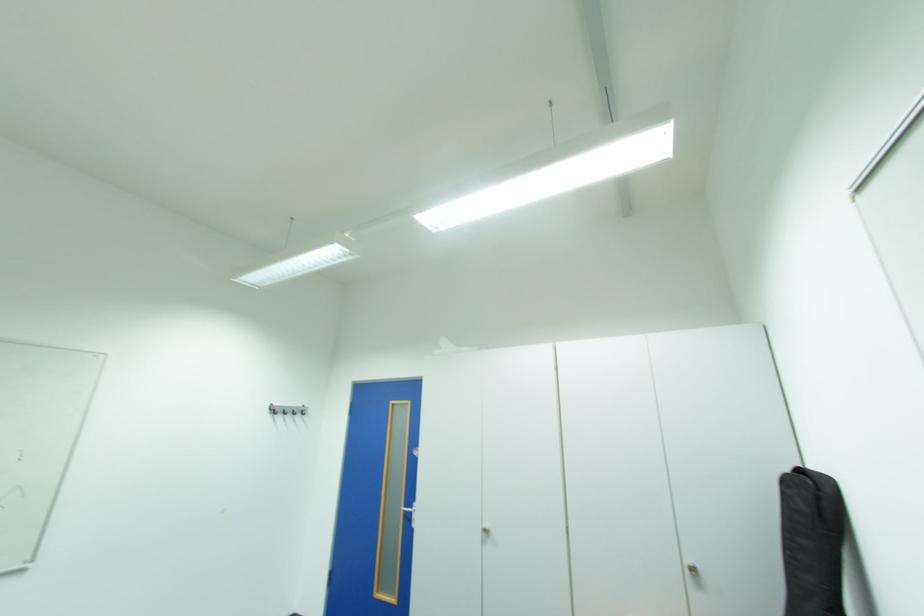
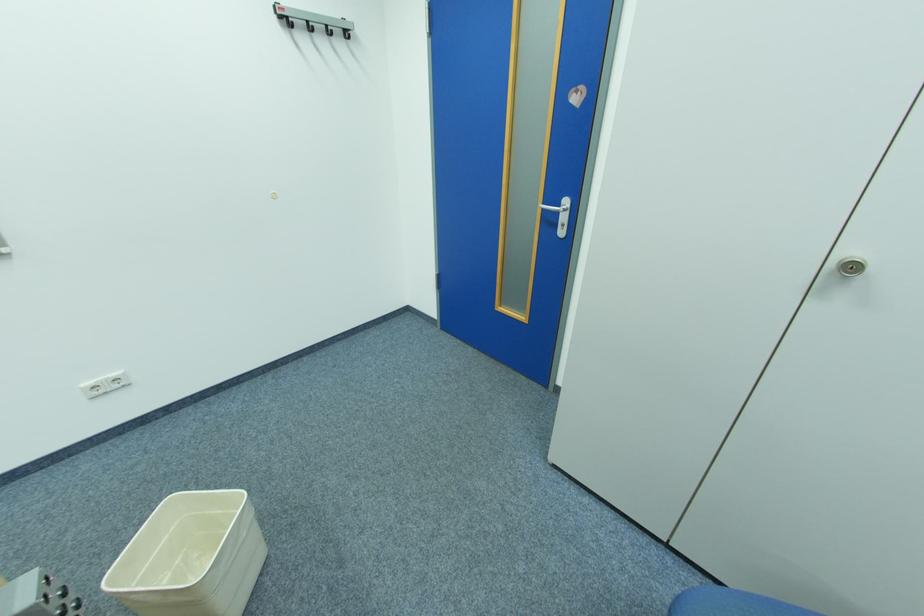
Find the pixel in the second image that matches pixel 414 511 in the first image.

(552, 209)